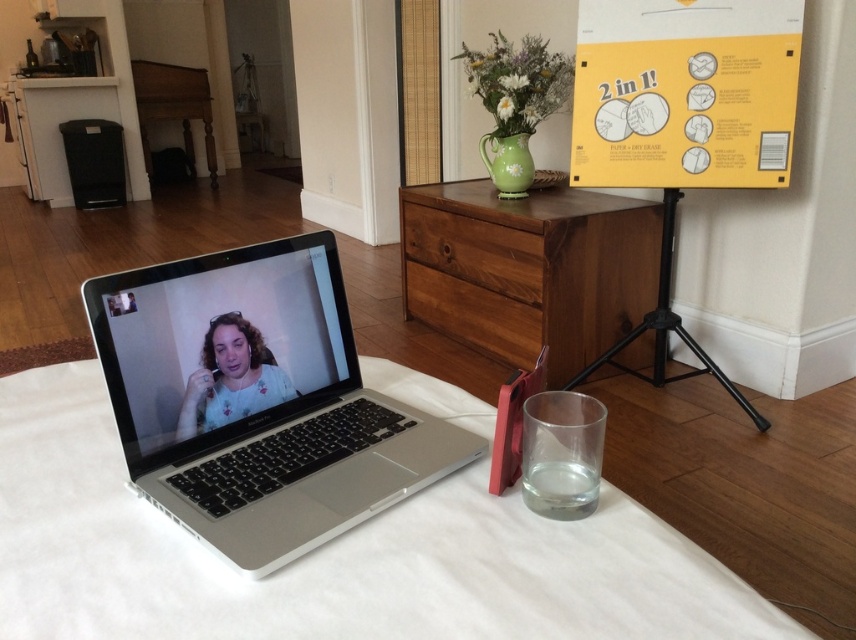
Question: Is wooden dresser at center smaller than matte black laptop at center?

Choices:
 (A) yes
 (B) no

Answer: (B)

Question: Which of the following is the farthest from the observer?

Choices:
 (A) silver metallic laptop at center
 (B) white fabric table at center

Answer: (A)

Question: Which point is farther to the camera?

Choices:
 (A) (48, 605)
 (B) (185, 298)

Answer: (B)

Question: Does silver metallic laptop at center come behind wooden drawer at center?

Choices:
 (A) no
 (B) yes

Answer: (A)

Question: Which point appears closest to the camera in this image?

Choices:
 (A) (471, 339)
 (B) (621, 272)
 (C) (616, 342)

Answer: (C)

Question: Is brown wood drawer at center closer to camera compared to black metal tripod at lower right?

Choices:
 (A) yes
 (B) no

Answer: (B)